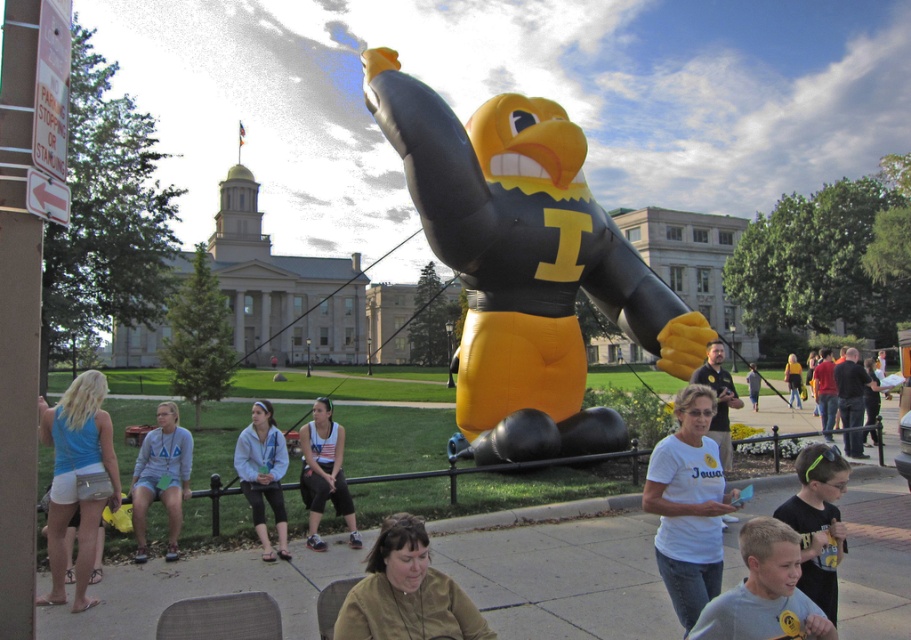
You are standing at the center of the grassy area where the mascot is placed. You need to find the brown leather jacket at lower center. In which direction should you move relative to the mascot to locate it?

The brown leather jacket at lower center is located at point [406,593], which is to the lower right direction from the mascot. Move towards the lower right relative to the mascot to find it.

Consider the image. You are standing at the point closest to the mascot. Which point, point (52,577) or point (792,403), is closer to you?

Point (52,577) is in front of point (792,403), so it is closer to you.